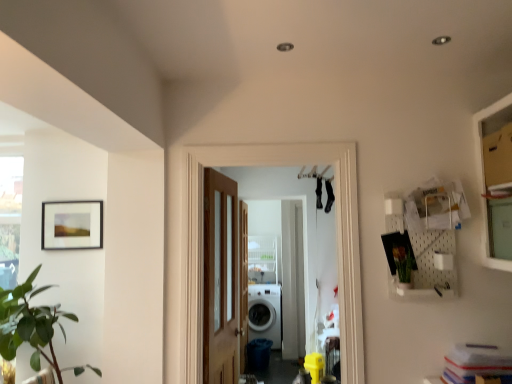
Describe the element at coordinates (265, 313) in the screenshot. I see `white glossy washing machine at center` at that location.

Identify the location of white glossy washing machine at center. (265, 313).

Image resolution: width=512 pixels, height=384 pixels. Describe the element at coordinates (220, 279) in the screenshot. I see `wooden door at center` at that location.

Consider the image. Measure the distance between matte black picture frame at upper left and camera.

They are 8.62 feet apart.

Describe the element at coordinates (32, 326) in the screenshot. I see `green leafy plant at left` at that location.

This screenshot has width=512, height=384. What do you see at coordinates (424, 239) in the screenshot?
I see `white pegboard at upper right` at bounding box center [424, 239].

Find the location of a particular element. This screenshot has width=512, height=384. green matte vase at right is located at coordinates (403, 262).

From the image's perspective, is wooden door at center located above or below white pegboard at upper right?

wooden door at center is situated lower than white pegboard at upper right in the image.

Is wooden door at center inside or outside of white pegboard at upper right?

wooden door at center is not enclosed by white pegboard at upper right.

Considering the relative sizes of wooden door at center and white pegboard at upper right in the image provided, is wooden door at center smaller than white pegboard at upper right?

Incorrect, wooden door at center is not smaller in size than white pegboard at upper right.

Does point (222, 203) appear closer or farther from the camera than point (423, 261)?

Point (222, 203).

From the image's perspective, is green matte vase at right below matte black picture frame at upper left?

Yes, from the image's perspective, green matte vase at right is below matte black picture frame at upper left.

Is green matte vase at right taller or shorter than matte black picture frame at upper left?

In the image, green matte vase at right appears to be shorter than matte black picture frame at upper left.

Measure the distance from green matte vase at right to matte black picture frame at upper left.

The distance of green matte vase at right from matte black picture frame at upper left is 1.89 meters.

Is green matte vase at right at the right side of matte black picture frame at upper left?

Correct, you'll find green matte vase at right to the right of matte black picture frame at upper left.

From a real-world perspective, who is located higher, white glossy washing machine at center or wooden door at center?

From a 3D spatial view, wooden door at center is above.

Which of these two, white glossy washing machine at center or wooden door at center, stands shorter?

With less height is white glossy washing machine at center.

Considering the relative sizes of white glossy washing machine at center and wooden door at center in the image provided, is white glossy washing machine at center wider than wooden door at center?

Yes, white glossy washing machine at center is wider than wooden door at center.

From the image's perspective, would you say clear glass screen door at center is shown under green leafy plant at left?

Indeed, from the image's perspective, clear glass screen door at center is shown beneath green leafy plant at left.

Considering the sizes of objects clear glass screen door at center and green leafy plant at left in the image provided, who is bigger, clear glass screen door at center or green leafy plant at left?

green leafy plant at left is bigger.

Between clear glass screen door at center and green leafy plant at left, which one has less height?

With less height is green leafy plant at left.

Which object is closer to the camera, clear glass screen door at center or green leafy plant at left?

green leafy plant at left is closer to the camera.

From a real-world perspective, which is physically below, green leafy plant at left or white pegboard at upper right?

From a 3D spatial view, green leafy plant at left is below.

Find the location of a particular element. This screenshot has width=512, height=384. shelf above the green leafy plant at left (from a real-world perspective) is located at coordinates (424, 239).

Between green leafy plant at left and white pegboard at upper right, which one is positioned behind?

white pegboard at upper right is behind.

Are green leafy plant at left and white pegboard at upper right making contact?

No, green leafy plant at left is not with white pegboard at upper right.

Which is more to the left, white pegboard at upper right or green leafy plant at left?

green leafy plant at left.

In the image, there is a white pegboard at upper right. Identify the location of houseplant below it (from a real-world perspective). tap(32, 326).

Consider the image. Which is correct: white pegboard at upper right is inside green leafy plant at left, or outside of it?

white pegboard at upper right is outside green leafy plant at left.

Is point (407, 289) closer to camera compared to point (21, 294)?

That is True.

From their relative heights in the image, would you say white pegboard at upper right is taller or shorter than green matte vase at right?

Considering their sizes, white pegboard at upper right has more height than green matte vase at right.

Is white pegboard at upper right to the left of green matte vase at right from the viewer's perspective?

In fact, white pegboard at upper right is to the right of green matte vase at right.

Identify the location of shelf in front of the wooden door at center. The image size is (512, 384). (424, 239).

This screenshot has height=384, width=512. I want to click on plant below the matte black picture frame at upper left (from a real-world perspective), so click(403, 262).

Estimate the real-world distances between objects in this image. Which object is closer to wooden door at center, white pegboard at upper right or clear glass screen door at center?

clear glass screen door at center is closer to wooden door at center.

Which object lies further to the anchor point white glossy washing machine at center, green leafy plant at left or green matte vase at right?

green matte vase at right is further to white glossy washing machine at center.

Based on their spatial positions, is green matte vase at right or matte black picture frame at upper left closer to white glossy washing machine at center?

matte black picture frame at upper left is closer to white glossy washing machine at center.

Considering their positions, is white glossy washing machine at center positioned further to green leafy plant at left than clear glass screen door at center?

white glossy washing machine at center.

Considering their positions, is green matte vase at right positioned closer to white glossy washing machine at center than clear glass screen door at center?

Among the two, clear glass screen door at center is located nearer to white glossy washing machine at center.

From the image, which object appears to be farther from green matte vase at right, matte black picture frame at upper left or clear glass screen door at center?

Among the two, matte black picture frame at upper left is located further to green matte vase at right.

When comparing their distances from green matte vase at right, does matte black picture frame at upper left or white pegboard at upper right seem further?

The object further to green matte vase at right is matte black picture frame at upper left.

From the picture: When comparing their distances from matte black picture frame at upper left, does clear glass screen door at center or white pegboard at upper right seem closer?

The object closer to matte black picture frame at upper left is clear glass screen door at center.

Image resolution: width=512 pixels, height=384 pixels. Identify the location of door between green leafy plant at left and green matte vase at right from left to right. (220, 279).

Locate an element on the screen. This screenshot has height=384, width=512. picture frame between green matte vase at right and white glossy washing machine at center in the front-back direction is located at coordinates (72, 225).

Find the location of `picture frame positioned between wooden door at center and white glossy washing machine at center from near to far`. picture frame positioned between wooden door at center and white glossy washing machine at center from near to far is located at coordinates (72, 225).

Identify the location of door between matte black picture frame at upper left and white pegboard at upper right in the horizontal direction. The image size is (512, 384). (220, 279).